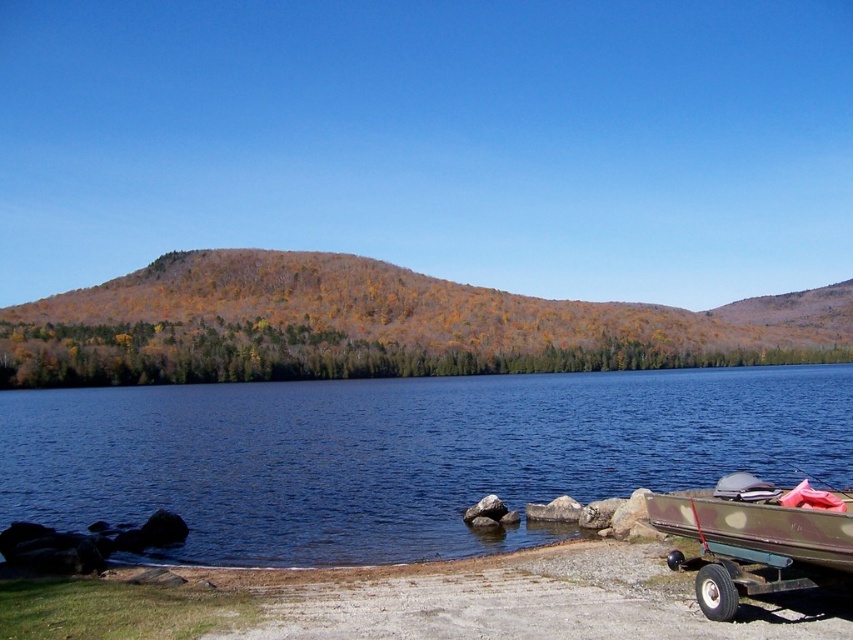
Between point (166, 419) and point (711, 620), which one is positioned behind?

Positioned behind is point (166, 419).

Does point (167, 480) lie behind point (764, 588)?

Yes.

Where is `blue water at lower center`? The image size is (853, 640). blue water at lower center is located at coordinates [403, 452].